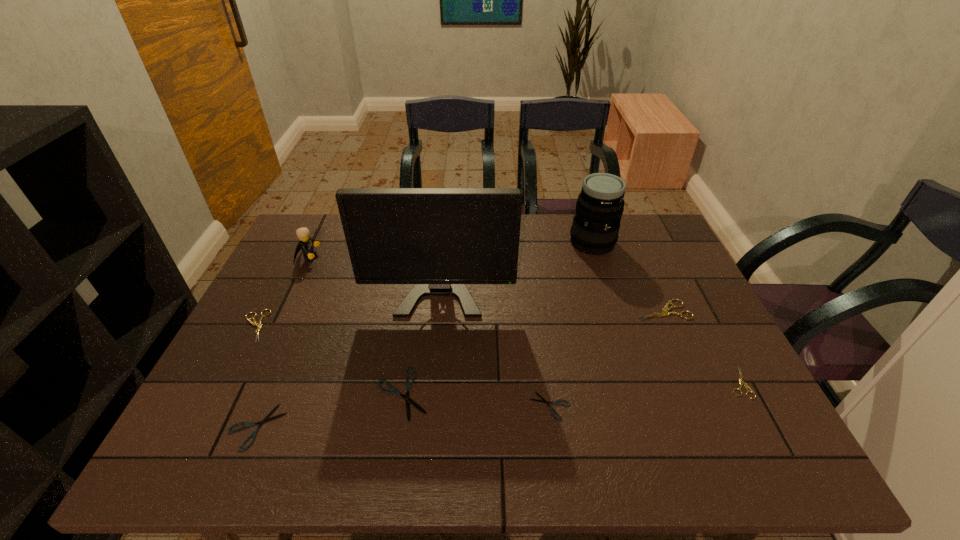
Locate an element on the screen. the smallest beige shears is located at coordinates (x=740, y=380).

Identify the location of the leftmost black shears. This screenshot has width=960, height=540. (266, 419).

At what (x,y) coordinates should I click in order to perform the action: click on the second biggest black shears. Please return your answer as a coordinate pair (x, y). Looking at the image, I should click on (266, 419).

Image resolution: width=960 pixels, height=540 pixels. I want to click on the sixth object from left to right, so click(x=544, y=401).

You are a GUI agent. You are given a task and a screenshot of the screen. Output one action in this format:
    pyautogui.click(x=<x>, y=<y>)
    Task: Click on the shortest shears
    Image resolution: width=960 pixels, height=540 pixels.
    Given the screenshot: What is the action you would take?
    pyautogui.click(x=544, y=401)

You are a GUI agent. You are given a task and a screenshot of the screen. Output one action in this format:
    pyautogui.click(x=<x>, y=<y>)
    Task: Click on the free space located 0.150m on the screen side of the tallest object
    
    Given the screenshot: What is the action you would take?
    pyautogui.click(x=433, y=362)

This screenshot has height=540, width=960. I want to click on vacant space located 0.100m on the front of the eighth shortest object, so click(x=604, y=278).

Identify the location of free space located 0.250m on the front-facing side of the third tallest object. (398, 258).

Locate an element on the screen. This screenshot has width=960, height=540. vacant space located 0.160m on the left of the fifth shears from left to right is located at coordinates (577, 310).

Identify the location of blank space located 0.080m on the front of the leftmost beige shears. (232, 369).